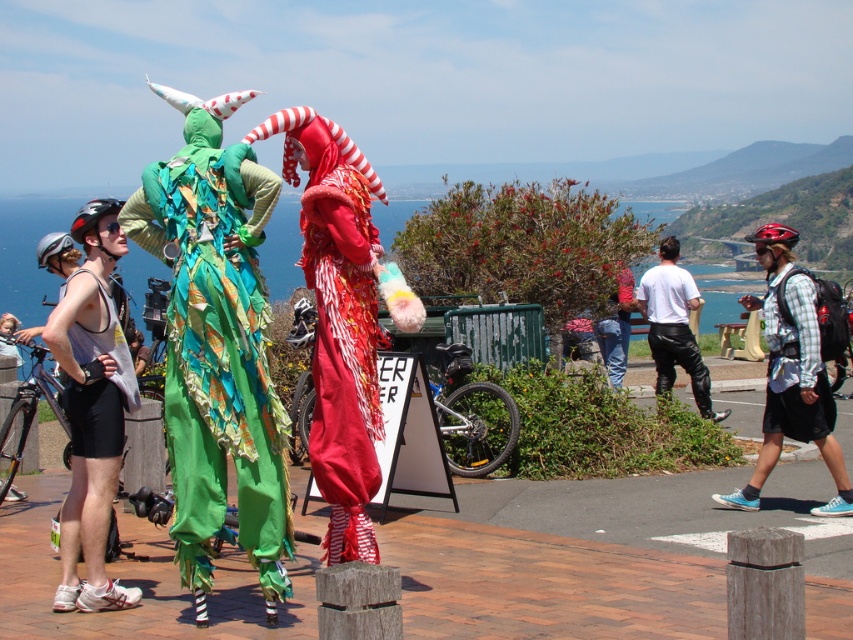
Who is shorter, plaid shirt and shorts at right or white matte shirt at center?

white matte shirt at center is shorter.

Is plaid shirt and shorts at right below white matte shirt at center?

No.

Is point (787, 387) less distant than point (653, 268)?

That is True.

At what (x,y) coordinates should I click in order to perform the action: click on plaid shirt and shorts at right. Please return your answer as a coordinate pair (x, y). This screenshot has height=640, width=853. Looking at the image, I should click on (793, 369).

Based on the photo, who is more distant from viewer, (323, 480) or (677, 317)?

Positioned behind is point (677, 317).

Locate an element on the screen. red satin clown at center is located at coordinates (338, 320).

This screenshot has width=853, height=640. In order to click on red satin clown at center in this screenshot , I will do `click(338, 320)`.

Who is lower down, red satin clown at center or plaid shirt and shorts at right?

red satin clown at center

Between point (341, 349) and point (822, 433), which one is positioned in front?

Positioned in front is point (341, 349).

Which is behind, point (314, 257) or point (747, 301)?

Point (747, 301)

Where is `red satin clown at center`? red satin clown at center is located at coordinates (338, 320).